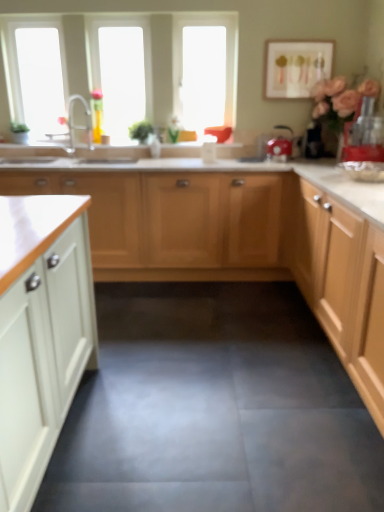
Where is `vacant point above transparent glass window at upper left, which appears as the 2th window screen when viewed from the right (from a real-world perspective)`? This screenshot has width=384, height=512. vacant point above transparent glass window at upper left, which appears as the 2th window screen when viewed from the right (from a real-world perspective) is located at coordinates 34,16.